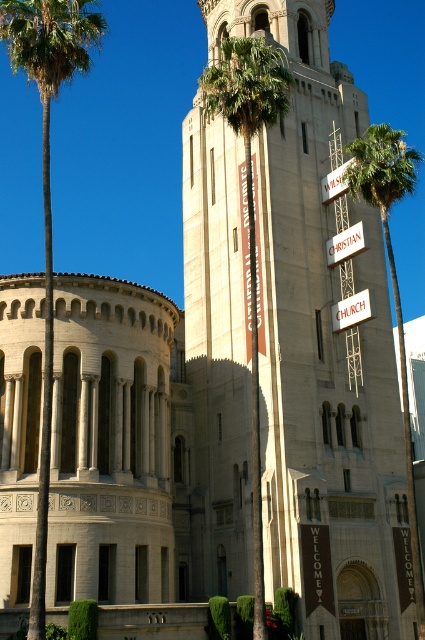
You are standing at the entrance of the grand architectural structure and see the green leafy palm tree at left. If you were to walk directly towards the palm tree, would you move to the left or right side of the building?

The green leafy palm tree at left is located at coordinates point (48, 188), which is on the left side of the building. Therefore, to reach it, you would need to move towards the left side of the building.